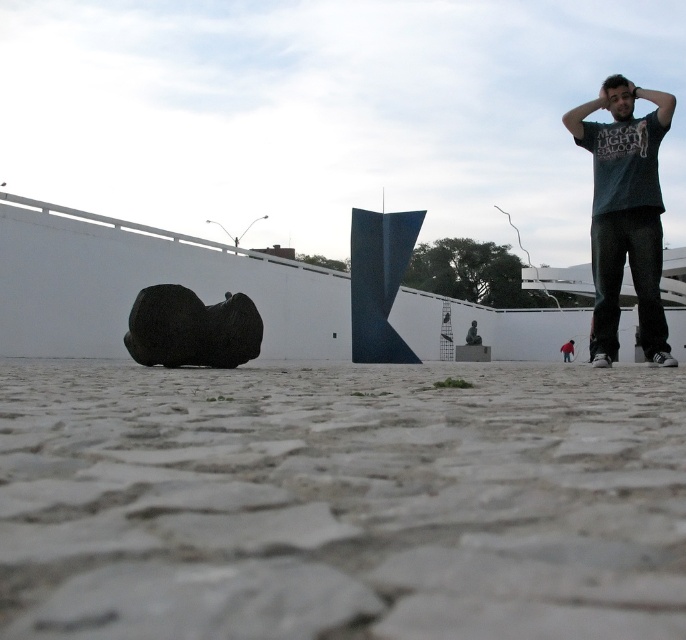
Question: Is cobblestone pavement at lower center bigger than black matte sculpture at lower left?

Choices:
 (A) yes
 (B) no

Answer: (A)

Question: Which point is farther to the camera?

Choices:
 (A) cobblestone pavement at lower center
 (B) black matte sculpture at lower left

Answer: (B)

Question: Which point is closer to the camera?

Choices:
 (A) (595, 278)
 (B) (530, 493)

Answer: (B)

Question: Does dark green t-shirt at right appear on the left side of black matte sculpture at lower left?

Choices:
 (A) no
 (B) yes

Answer: (A)

Question: Which of the following is the farthest from the observer?

Choices:
 (A) cobblestone pavement at lower center
 (B) black matte sculpture at lower left
 (C) dark green t-shirt at right

Answer: (C)

Question: Can you confirm if dark green t-shirt at right is positioned to the right of black matte sculpture at lower left?

Choices:
 (A) yes
 (B) no

Answer: (A)